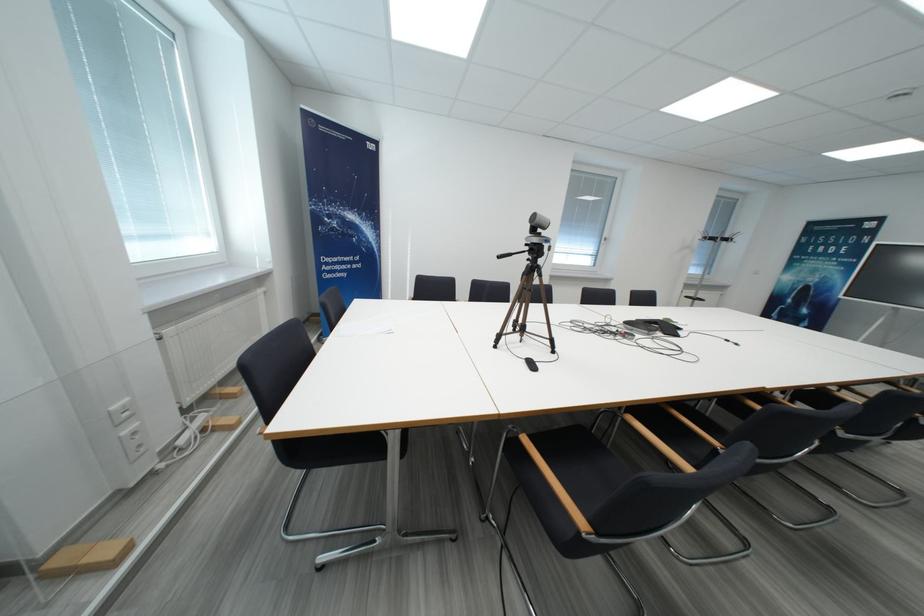
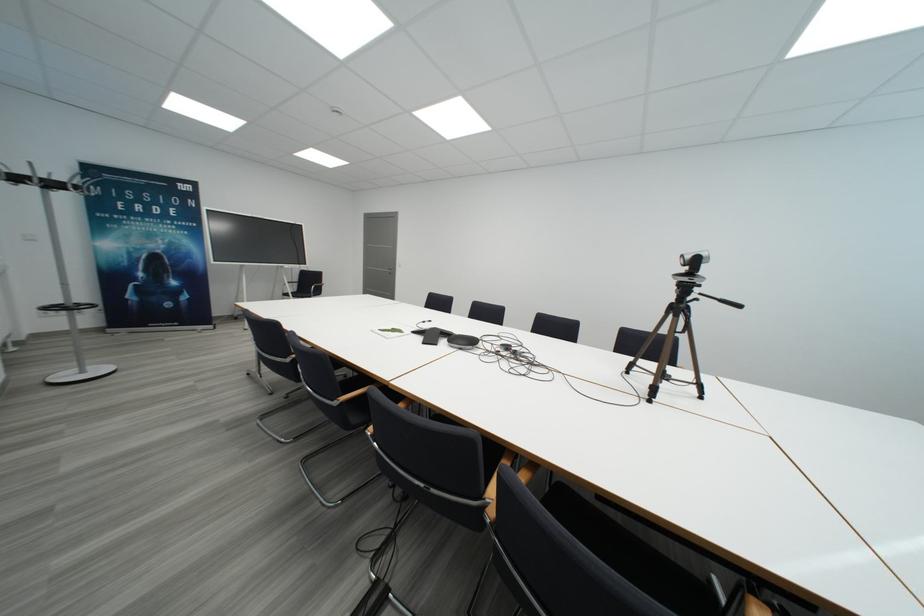
The point at (531, 254) is marked in the first image. Where is the corresponding point in the second image?

(708, 297)